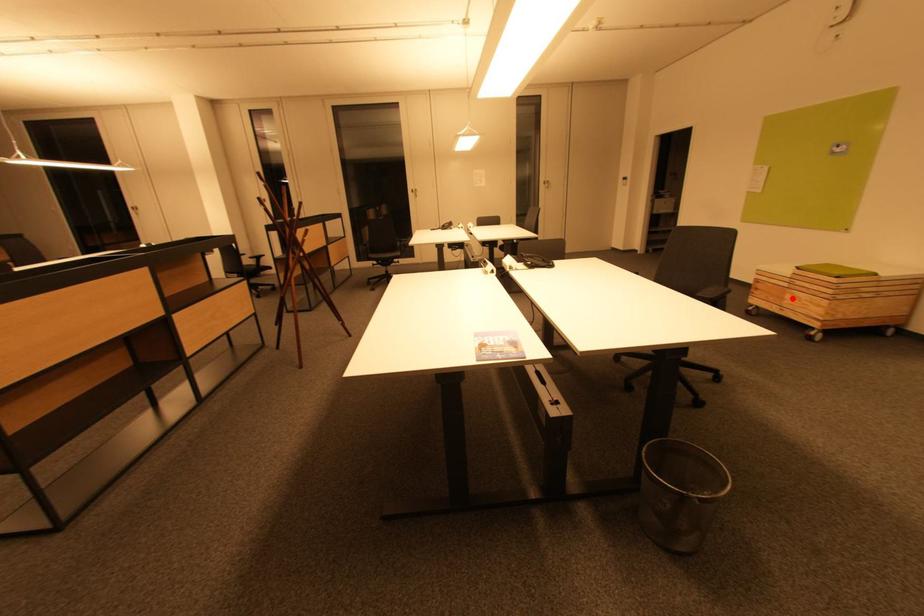
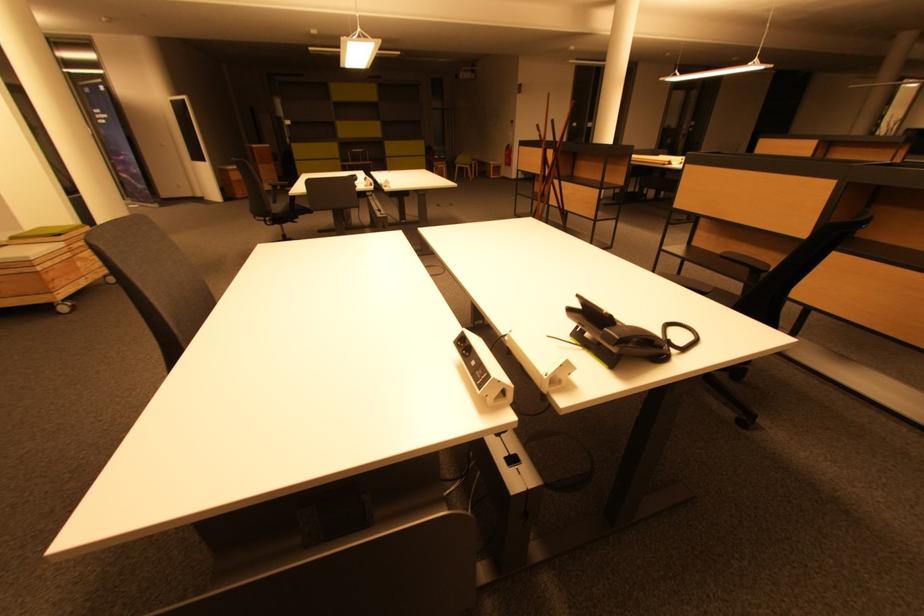
Question: I am providing you with two images of the same scene from different viewpoints. In image1, a red point is highlighted. Considering the same 3D point in image2, which of the following is correct?

Choices:
 (A) It is closer
 (B) It is farther

Answer: (B)